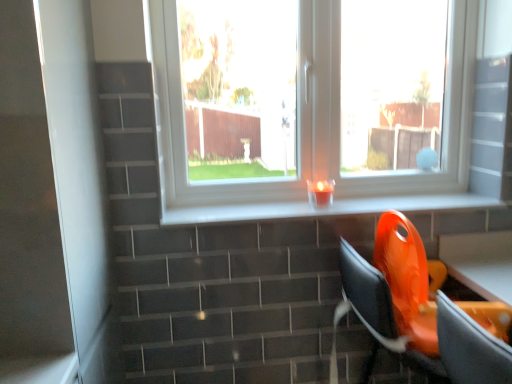
At what (x,y) coordinates should I click in order to perform the action: click on free space below white glossy window sill at center (from a real-world perspective). Please return your answer as a coordinate pair (x, y). This screenshot has width=512, height=384. Looking at the image, I should click on (342, 206).